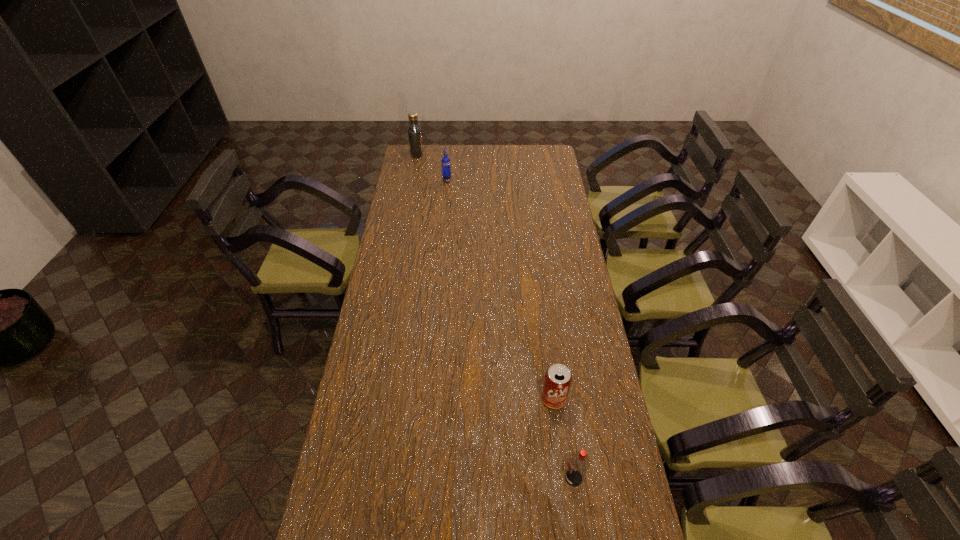
The image size is (960, 540). Find the location of `free location that satisfies the following two spatial constraints: 1. on the front-facing side of the farthest vodka; 2. on the left side of the second nearest object`. free location that satisfies the following two spatial constraints: 1. on the front-facing side of the farthest vodka; 2. on the left side of the second nearest object is located at coordinates (371, 399).

This screenshot has width=960, height=540. I want to click on free space that satisfies the following two spatial constraints: 1. on the front-facing side of the tallest vodka; 2. on the right side of the second farthest vodka, so pos(412,181).